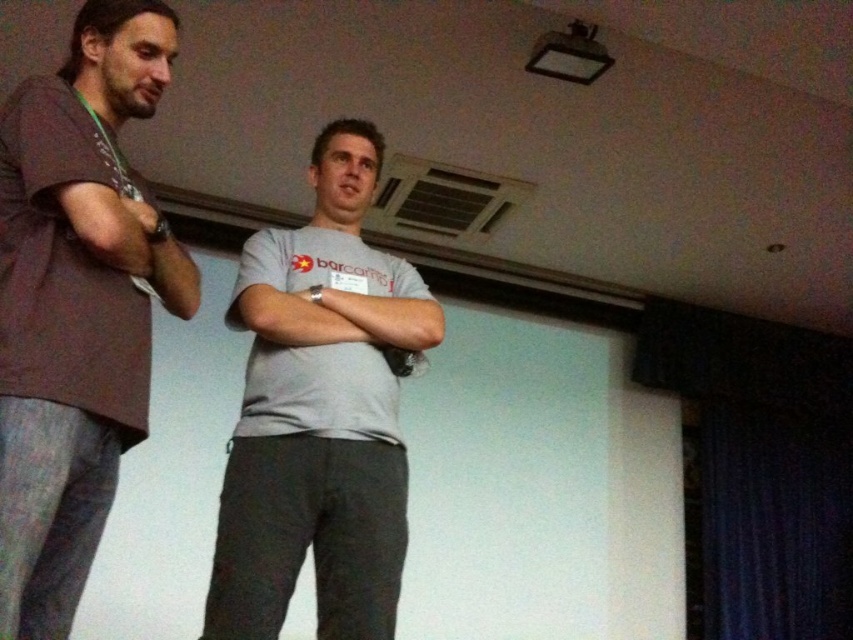
This screenshot has height=640, width=853. What do you see at coordinates (76, 305) in the screenshot?
I see `matte brown shirt at left` at bounding box center [76, 305].

Between point (67, 109) and point (361, 275), which one is positioned behind?

Point (361, 275)

Is point (32, 195) behind point (312, 320)?

No, it is not.

Where is `matte brown shirt at left`? matte brown shirt at left is located at coordinates (76, 305).